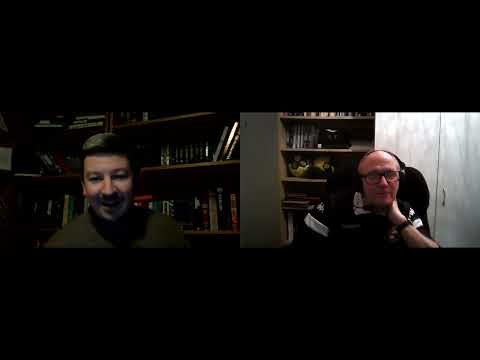
At what (x,y) coordinates should I click in order to perform the action: click on closet doors. Please return your answer as a coordinate pair (x, y). Looking at the image, I should click on (440, 184).